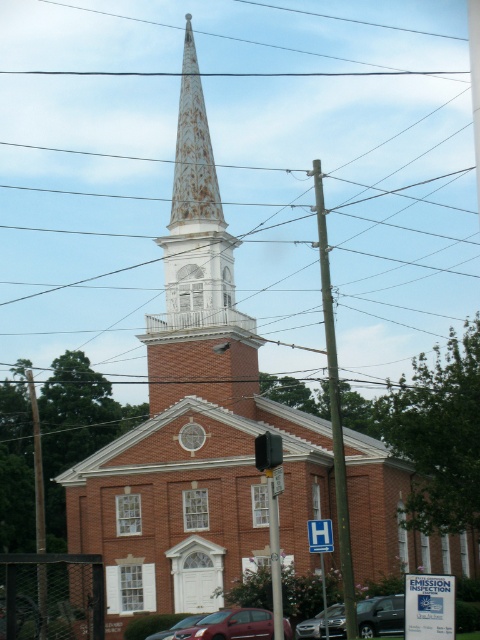
You are standing at the point marked as point (x=63, y=74) and want to take a photo of the church. If your camera is 1.6 meters above the ground, will you be able to capture the entire church in your photo without moving? The camera has a standard 50mm lens with a 46 degree vertical angle of view.

The point (x=63, y=74) is 185.84 meters away from the camera. Using the camera specifications, the vertical angle of view allows for a field of view height of approximately 2.6 meters at that distance. Since the church is taller than 2.6 meters, you wontr be able to capture the entire church in the photo without moving.

You are standing in front of the church and want to park your metallic silver sedan at center. The parking spot is located at coordinates point 0.958, 0.796. Can you safely park your car there?

Yes, you can safely park your metallic silver sedan at center at the coordinates point (382,612) as it is the designated parking spot.